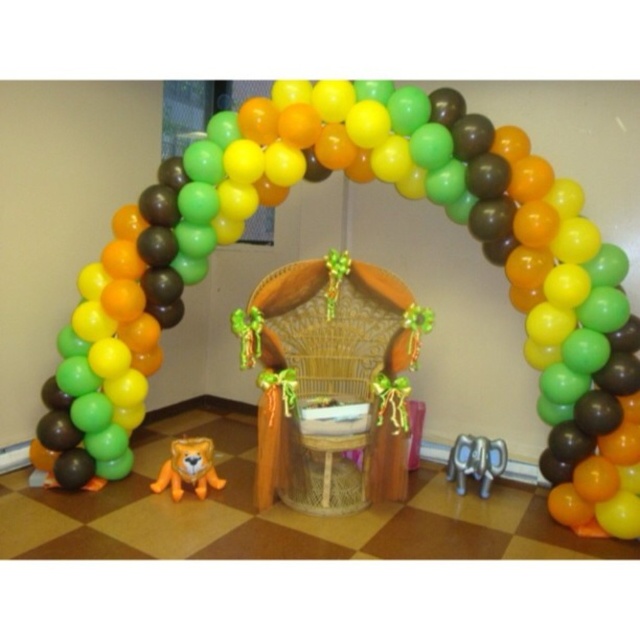
You are a photographer setting up for an event. You want to capture the woodenchair at center and the balloon arch at center in a single shot. Since both are at the center, how can you position yourself to ensure both are clearly visible in the frame?

Since the balloon arch at center is in front of the woodenchair at center, you should position yourself behind the woodenchair at center so that the balloon arch at center appears in front of it, ensuring both are visible in the frame.

You are planning to hang a banner from the ceiling that needs to be at least 2 meters tall to be visible from the entrance. Given the balloon arch at center and the woodenchair at center in the scene, can you determine if the space is tall enough?

The balloon arch at center is taller than woodenchair at center. Since the balloon arch at center is part of the setup and likely reaches near the ceiling, the space is probably tall enough for the banner requiring 2 meters.